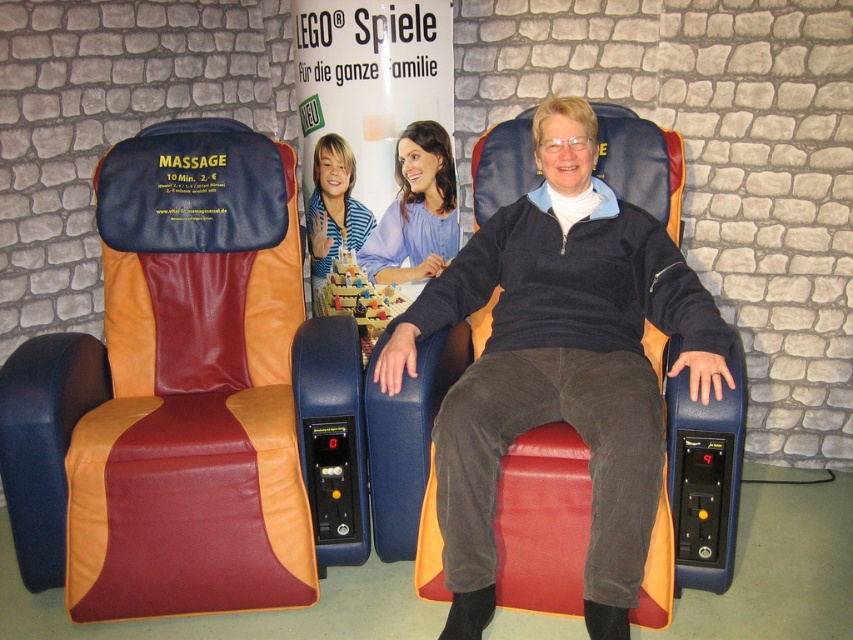
Who is positioned more to the left, matte blue shirt at center or striped shirt at center?

striped shirt at center is more to the left.

Is matte blue shirt at center positioned before striped shirt at center?

Yes.

Is point (410, 230) in front of point (347, 172)?

No, it is behind (347, 172).

The height and width of the screenshot is (640, 853). I want to click on matte blue shirt at center, so click(x=416, y=211).

Can you confirm if maroon leather massage chair at left is positioned above matte blue shirt at center?

No, maroon leather massage chair at left is not above matte blue shirt at center.

Is maroon leather massage chair at left positioned behind matte blue shirt at center?

No.

Is point (137, 316) farther from viewer compared to point (364, 262)?

No, it is in front of (364, 262).

Where is `maroon leather massage chair at left`? This screenshot has width=853, height=640. maroon leather massage chair at left is located at coordinates click(x=170, y=396).

Is matte blue massage chair at center positioned in front of striped shirt at center?

Yes, matte blue massage chair at center is closer to the viewer.

Does matte blue massage chair at center appear on the left side of striped shirt at center?

Incorrect, matte blue massage chair at center is not on the left side of striped shirt at center.

The width and height of the screenshot is (853, 640). I want to click on matte blue massage chair at center, so click(556, 385).